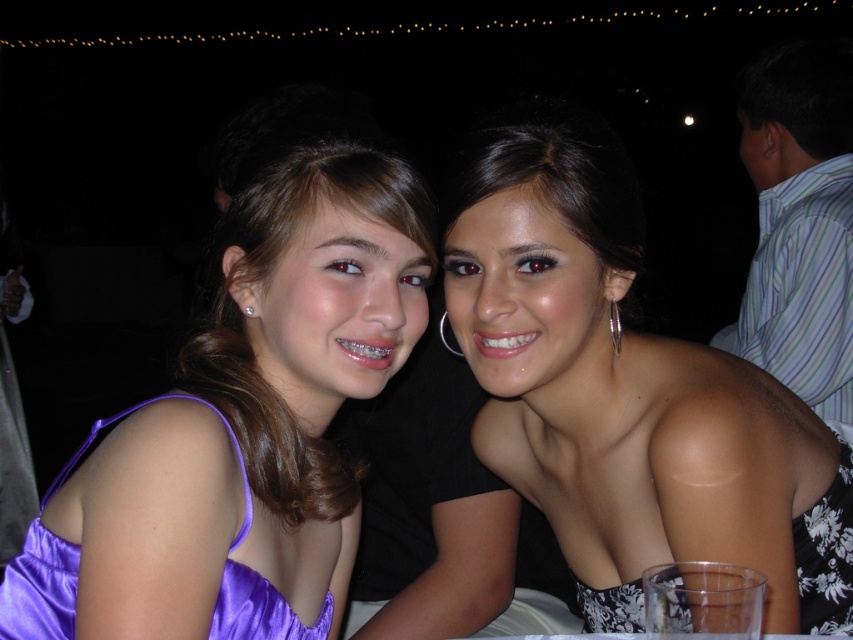
You are a photographer at an event and want to capture a closeup of the satin purple dress at left. The camera is currently focused at point 0.5, 0.5. Should you adjust the focus to point (242,426) to get the dress in focus?

Yes, because the satin purple dress at left is located at point (242,426), so adjusting the focus there would bring it into clear view.

You are a photographer at an event and notice the satin purple dress at left and the black satin dress at center. Which dress is closer to the camera?

The satin purple dress at left is closer to the camera because it is in front of the black satin dress at center.